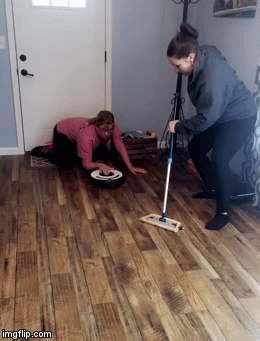
Where is `hardwood`? hardwood is located at coordinates (149, 315).